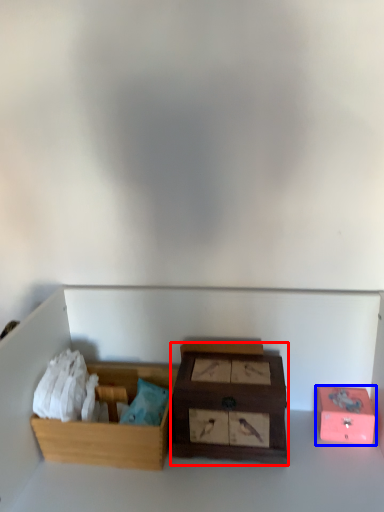
Question: Which point is further to the camera, box (highlighted by a red box) or box (highlighted by a blue box)?

Choices:
 (A) box
 (B) box

Answer: (B)